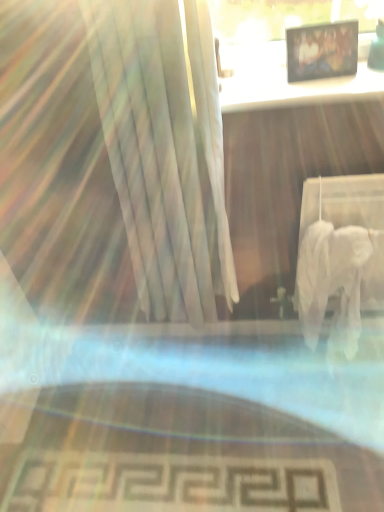
Identify the location of blank space to the left of wooden photo frame at upper center. This screenshot has height=512, width=384. (269, 91).